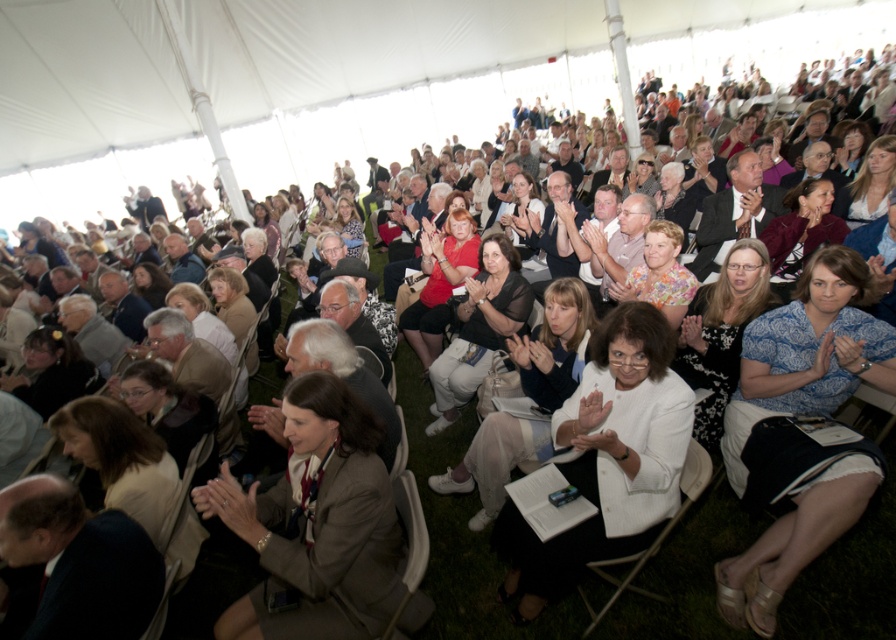
You are a photographer at the event and want to capture a photo of both the white fabric jacket at center and the matte brown jacket at center in the same frame. Since you can only focus on one subject at a time, which jacket should you focus on to ensure the other is still in the background?

You should focus on the white fabric jacket at center because it is positioned to the left of the matte brown jacket at center, so the matte brown jacket at center will naturally appear in the background of the photo.

You are standing at the entrance of the tent and want to locate the matte black jacket at center. According to the coordinates, where is it positioned relative to the tent entrance?

The matte black jacket at center is located at coordinates point (171, 413), which would place it approximately 64.7 percent from the left edge and 19.3 percent from the bottom edge of the tent area. Since you are at the entrance, it would be to your upper right direction.

You are organizing a photo shoot and need to position two models wearing the dark blue suit at lower left and the light brown leather jacket at center. Given their spatial requirements, which model should you place first in the frame to ensure both fit comfortably?

The dark blue suit at lower left should be placed first because it occupies less space than the light brown leather jacket at center, allowing more room to accommodate both models comfortably.